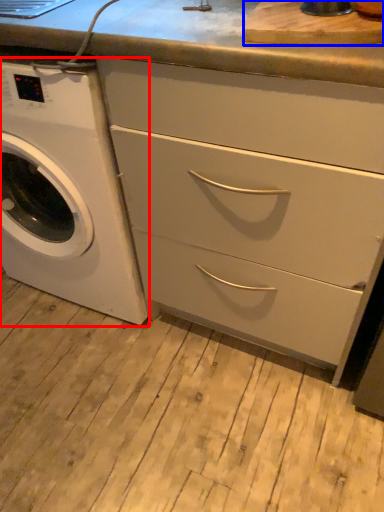
Question: Which of the following is the farthest to the observer, washing machine (highlighted by a red box) or cutting board (highlighted by a blue box)?

Choices:
 (A) washing machine
 (B) cutting board

Answer: (A)